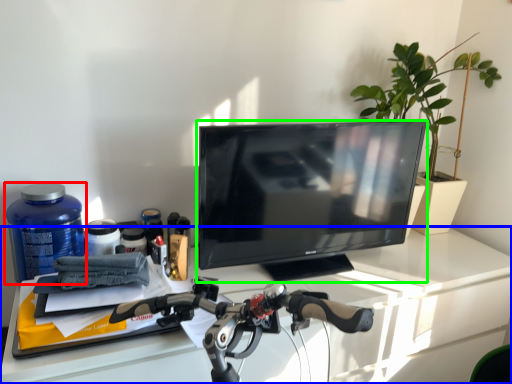
Question: Which object is positioned closest to bottle (highlighted by a red box)? Select from desk (highlighted by a blue box) and television (highlighted by a green box).

Choices:
 (A) desk
 (B) television

Answer: (A)